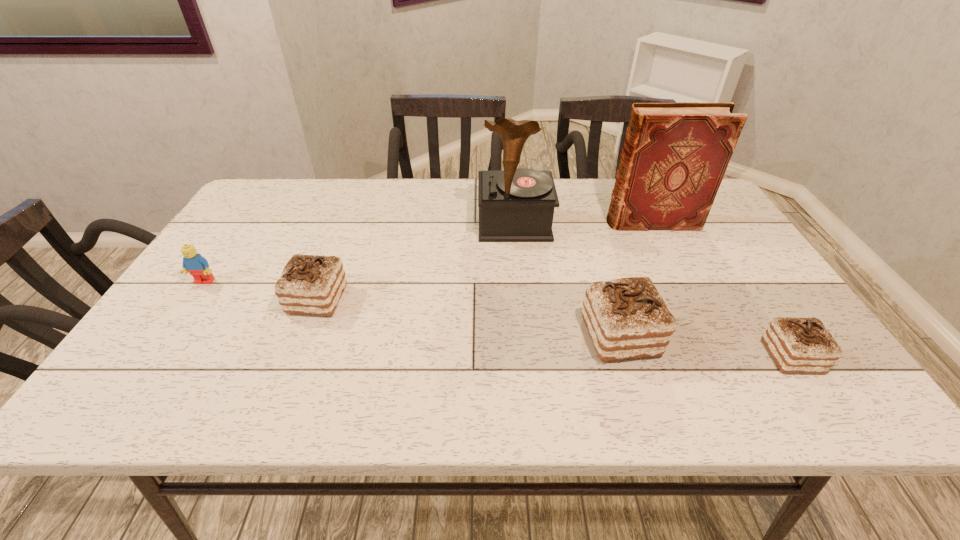
Find the location of a particular element. the leftmost chocolate cake is located at coordinates (310, 284).

At what (x,y) coordinates should I click in order to perform the action: click on the second tallest chocolate cake. Please return your answer as a coordinate pair (x, y). Looking at the image, I should click on (310, 284).

The image size is (960, 540). Identify the location of the tallest chocolate cake. click(626, 318).

Image resolution: width=960 pixels, height=540 pixels. In order to click on the shortest object in this screenshot , I will do `click(797, 345)`.

I want to click on the rightmost chocolate cake, so click(x=797, y=345).

You are a GUI agent. You are given a task and a screenshot of the screen. Output one action in this format:
    pyautogui.click(x=<x>, y=<y>)
    Task: Click on the fourth object from right to left
    The image size is (960, 540).
    Given the screenshot: What is the action you would take?
    pyautogui.click(x=515, y=205)

This screenshot has height=540, width=960. What are the coordinates of `hardback book` in the screenshot? It's located at (675, 155).

Identify the location of the leftmost object. Image resolution: width=960 pixels, height=540 pixels. click(193, 262).

This screenshot has height=540, width=960. What are the coordinates of `vacant space located on the left of the leftmost chocolate cake` in the screenshot? It's located at (220, 299).

The width and height of the screenshot is (960, 540). Identify the location of blank space located on the left of the second chocolate cake from left to right. (431, 336).